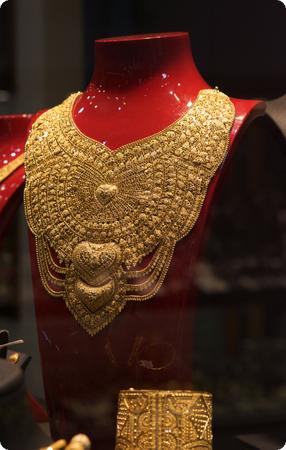
Find the location of `brown leather object`. brown leather object is located at coordinates (9, 377).